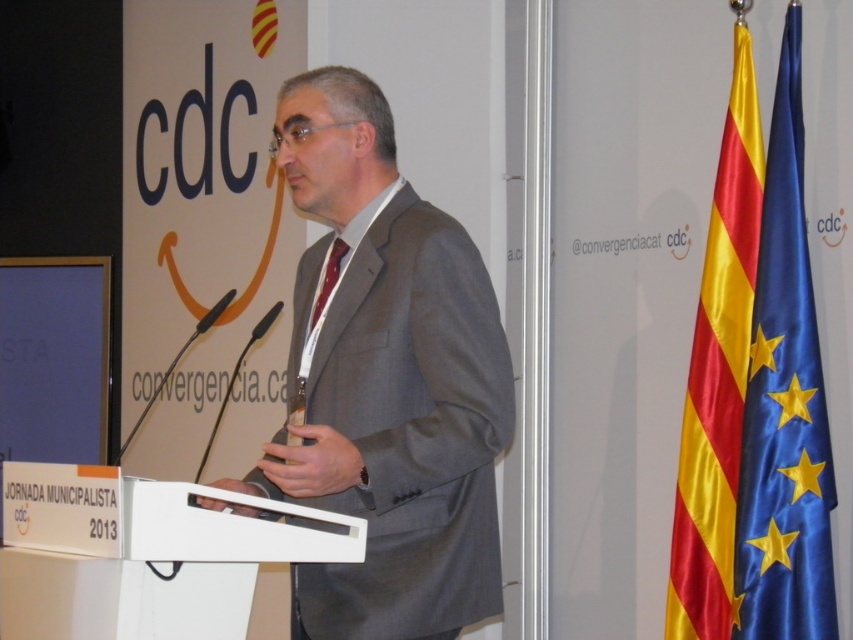
You are standing at the podium and want to adjust the blue fabric flag at right. If you face the direction of the banner, which direction should you turn to reach the flag?

The blue fabric flag at right is located at point (784, 403), so you should turn to your right to reach it.

You are attending a formal event and notice a man in a gray suit at center and a matte red tie at center. Which item is located to the right of the other?

The gray suit at center is positioned on the right side of matte red tie at center, so the gray suit at center is to the right of the matte red tie at center.